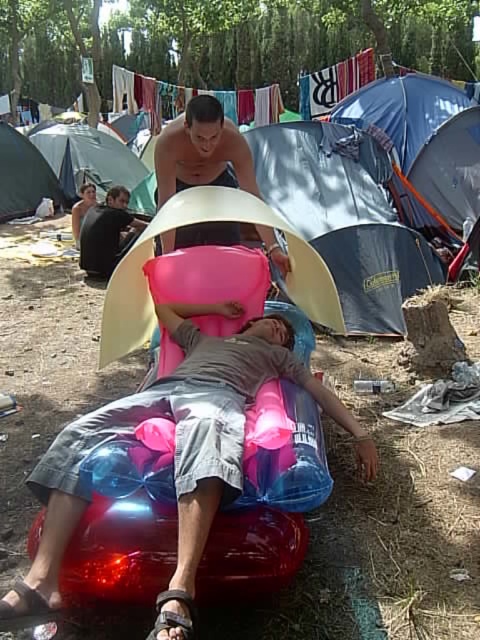
Question: Which point appears farthest from the camera in this image?

Choices:
 (A) (223, 241)
 (B) (96, 212)

Answer: (B)

Question: Which of the following is the closest to the observer?

Choices:
 (A) green fabric tent at upper left
 (B) green fabric tent at left

Answer: (B)

Question: Is green fabric tent at upper left below green fabric tent at left?

Choices:
 (A) no
 (B) yes

Answer: (A)

Question: Is dark gray fabric shirt at center thinner than black rubber sandal at lower left?

Choices:
 (A) no
 (B) yes

Answer: (A)

Question: Which object is closer to the camera taking this photo?

Choices:
 (A) pink inflatable at center
 (B) dark gray fabric shirt at center

Answer: (A)

Question: Is pink inflatable at center wider than green fabric tent at left?

Choices:
 (A) yes
 (B) no

Answer: (A)